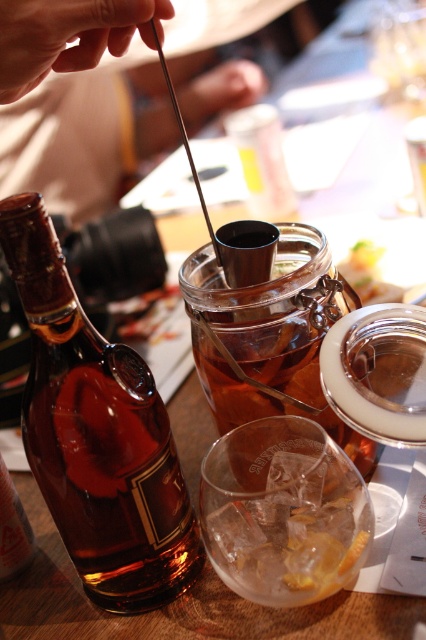
You are a bartender preparing a drink and need to locate the bottle of brown spirit. You have a coordinate system where the bottom left corner is the origin. The bottle is at point (97, 433). Can you confirm if this point is on the brown glass bottle at left?

Yes, the point (97, 433) is on the brown glass bottle at left according to the coordinates provided.